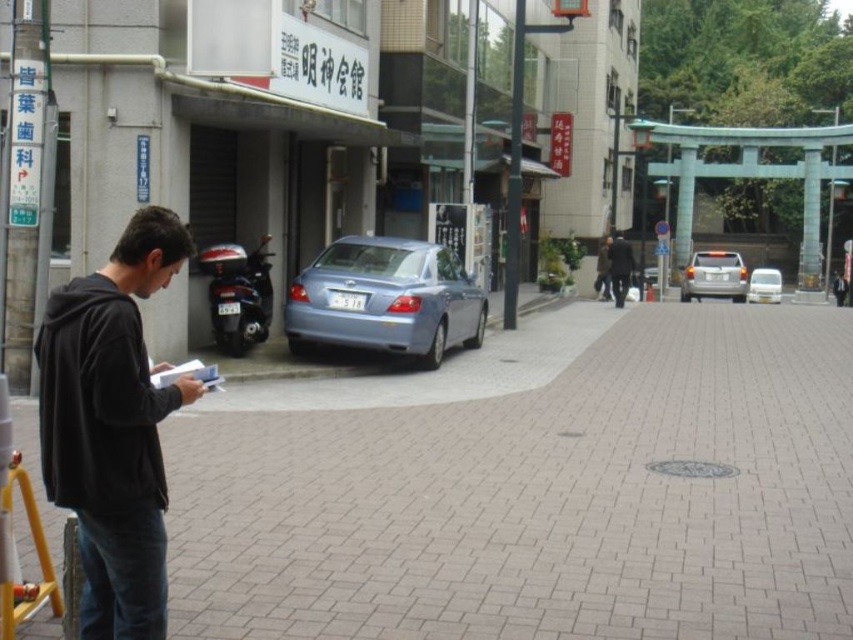
In the scene shown: Measure the distance between point (178, 390) and camera.

Point (178, 390) is 3.40 meters away from camera.

Does black matte sweatshirt at left appear on the left side of yellow/yellowish metal/yellowish metal at lower left?

Incorrect, black matte sweatshirt at left is not on the left side of yellow/yellowish metal/yellowish metal at lower left.

Locate an element on the screen. black matte sweatshirt at left is located at coordinates (97, 403).

Does black matte jacket at left have a larger size compared to satin silver car at center-right?

No.

Find the location of a particular element. This screenshot has width=853, height=640. black matte jacket at left is located at coordinates (112, 426).

Is black matte jacket at left shorter than black matte sweatshirt at left?

No, black matte jacket at left is not shorter than black matte sweatshirt at left.

How far apart are black matte jacket at left and black matte sweatshirt at left?

black matte jacket at left is 4.98 inches from black matte sweatshirt at left.

Between point (148, 259) and point (135, 492), which one is positioned behind?

The point (148, 259) is behind.

You are a GUI agent. You are given a task and a screenshot of the screen. Output one action in this format:
    pyautogui.click(x=<x>, y=<y>)
    Task: Click on the black matte jacket at left
    
    Given the screenshot: What is the action you would take?
    pyautogui.click(x=112, y=426)